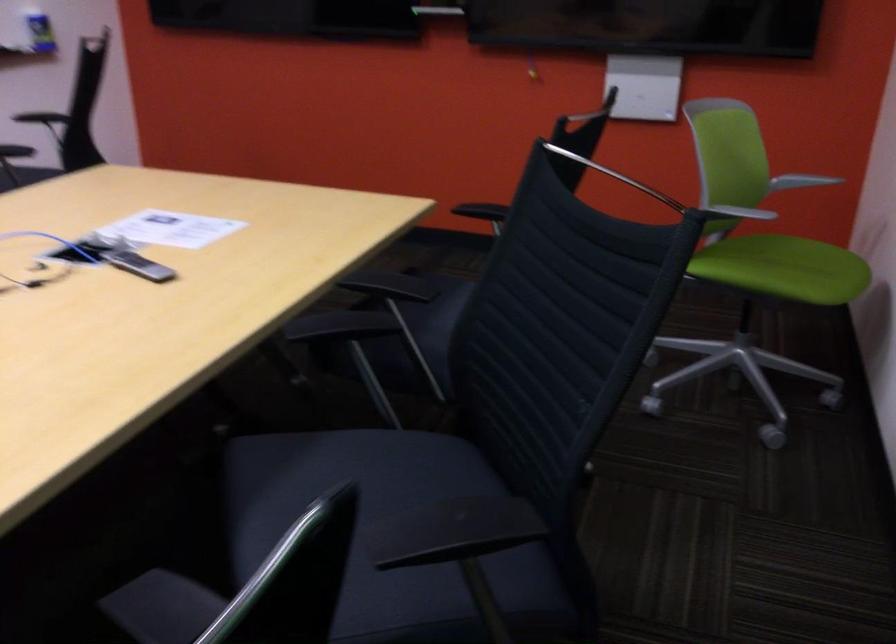
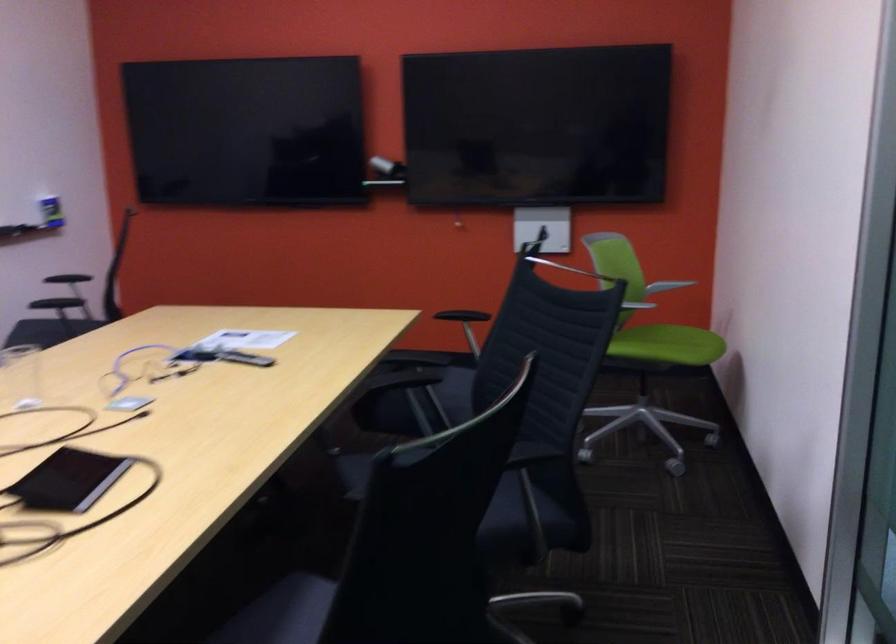
Where in the second image is the point corresponding to (x=791, y=187) from the first image?

(666, 286)